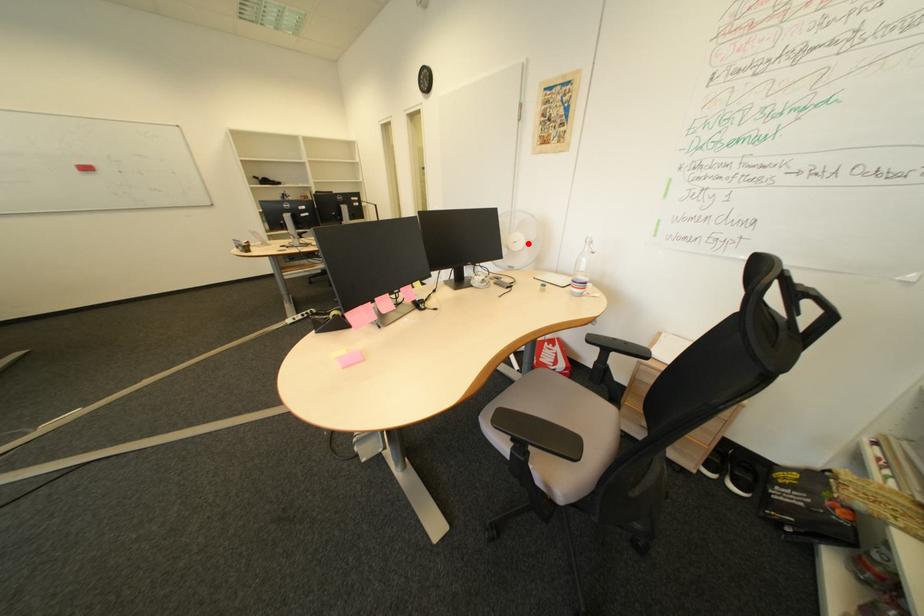
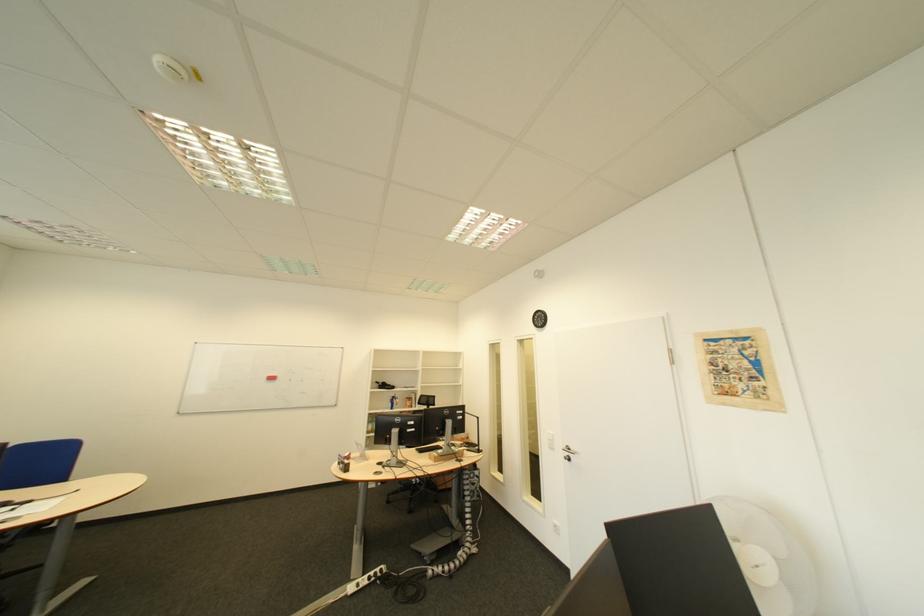
Find the pixel in the second image that matches the highlighted location in the first image.

(771, 567)